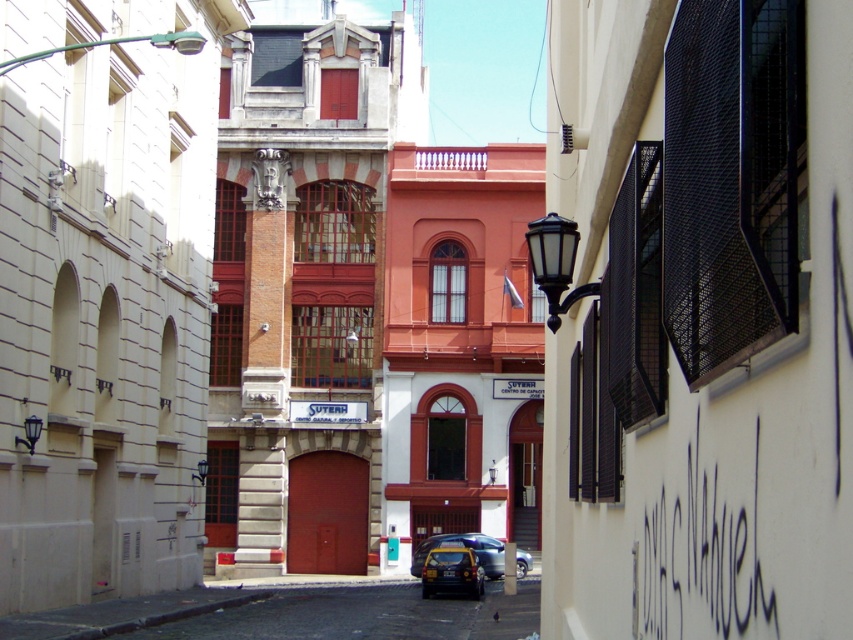
Question: Which object is closer to the camera taking this photo?

Choices:
 (A) metallic blue car at center
 (B) shiny black car at center

Answer: (B)

Question: Is shiny black car at center smaller than metallic blue car at center?

Choices:
 (A) no
 (B) yes

Answer: (B)

Question: Where is shiny black car at center located in relation to metallic blue car at center in the image?

Choices:
 (A) above
 (B) below

Answer: (A)

Question: Which point is closer to the camera?

Choices:
 (A) metallic blue car at center
 (B) shiny black car at center

Answer: (B)

Question: Which point is closer to the camera taking this photo?

Choices:
 (A) coord(426,595)
 (B) coord(490,536)

Answer: (A)

Question: Is shiny black car at center below metallic blue car at center?

Choices:
 (A) no
 (B) yes

Answer: (A)